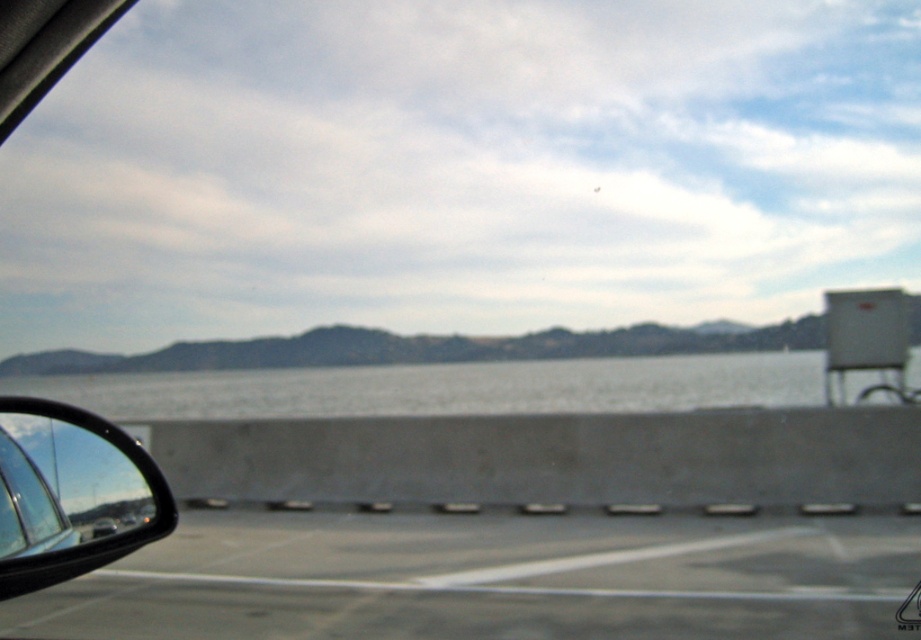
You are driving on the highway and see the gray asphalt highway at lower left and the gray concrete water at center. Which one is located to the left of the other?

The gray asphalt highway at lower left is positioned on the left side of gray concrete water at center.

Looking at this image, you are a passenger in a car and looking out the window. You see a point marked at coordinate [447,387]. Based on the scene description, what does this point most likely represent?

The point at coordinate [447,387] most likely represents the gray concrete water at center as described in the scene.